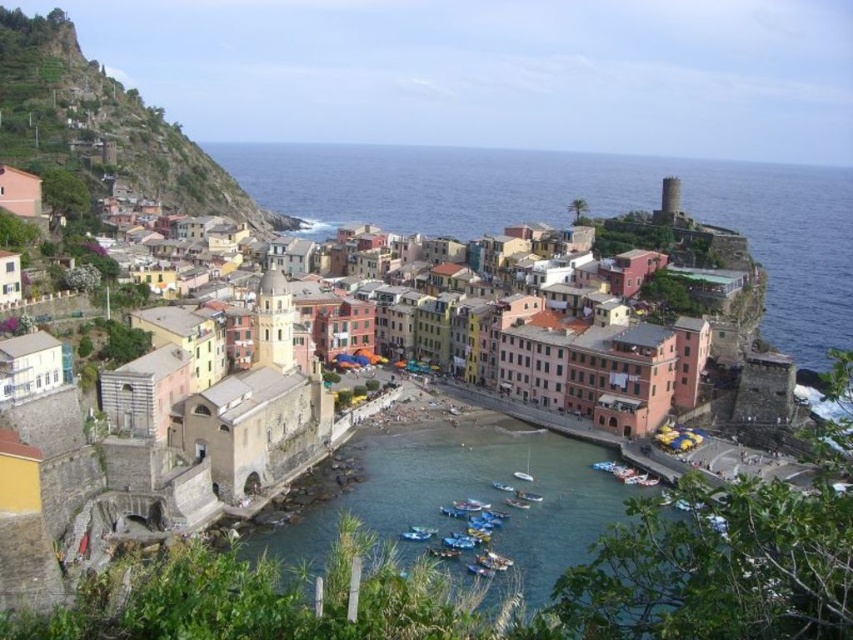
Is rustic stone houses at upper left thinner than metallic blue boat at lower center?

No, rustic stone houses at upper left is not thinner than metallic blue boat at lower center.

Between rustic stone houses at upper left and metallic blue boat at lower center, which one has less height?

Standing shorter between the two is metallic blue boat at lower center.

I want to click on rustic stone houses at upper left, so click(x=103, y=124).

I want to click on rustic stone houses at upper left, so click(x=103, y=124).